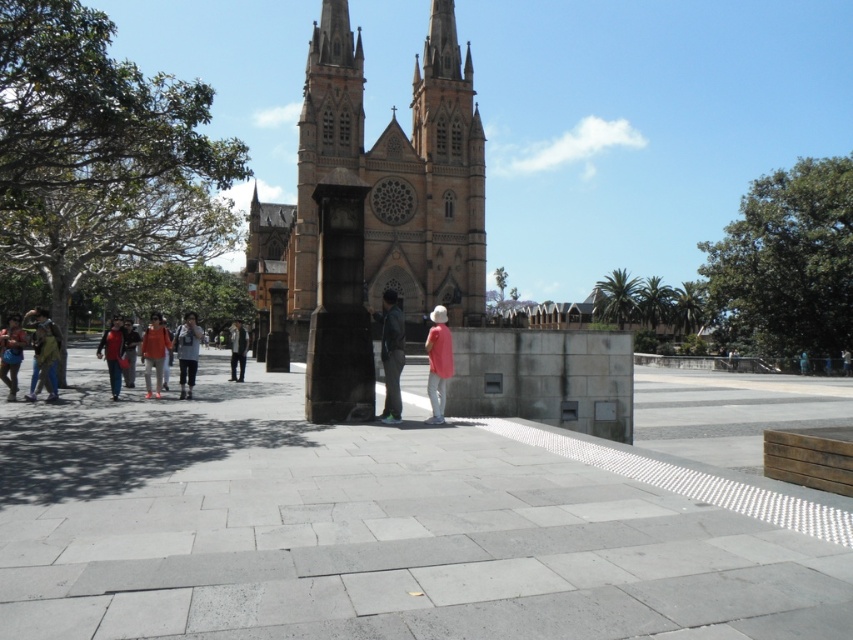
Question: Is the position of brown stone church at center less distant than that of denim jacket at left?

Choices:
 (A) yes
 (B) no

Answer: (B)

Question: In this image, where is gray concrete plaza at center located relative to brown stone church at center?

Choices:
 (A) above
 (B) below

Answer: (B)

Question: Which point is farther to the camera?

Choices:
 (A) (183, 376)
 (B) (62, 474)
 (C) (396, 209)

Answer: (C)

Question: Is gray concrete plaza at center below pink fabric hat at center?

Choices:
 (A) yes
 (B) no

Answer: (A)

Question: Which is nearer to the denim jacket at center?

Choices:
 (A) matte black jacket at center
 (B) matte black jacket at left

Answer: (A)

Question: Which point is closer to the camera?

Choices:
 (A) (149, 358)
 (B) (247, 342)
 (C) (123, 371)
 (D) (439, 413)

Answer: (D)